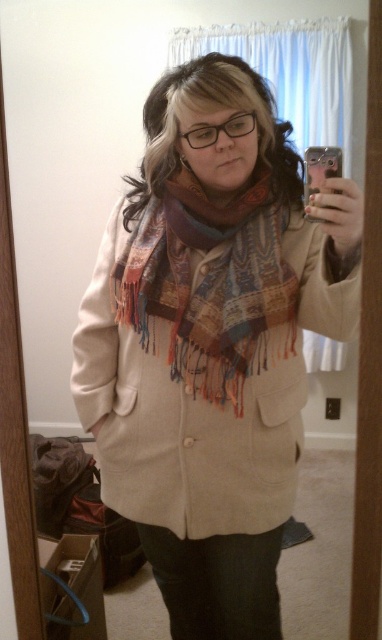
Question: Is paisley scarf at center below metallic silver phone at upper right?

Choices:
 (A) yes
 (B) no

Answer: (A)

Question: Is multicolored woven scarf at center below metallic silver phone at upper right?

Choices:
 (A) no
 (B) yes

Answer: (B)

Question: Which of the following is the closest to the observer?

Choices:
 (A) paisley scarf at center
 (B) metallic silver phone at upper right
 (C) multicolored woven scarf at center

Answer: (A)

Question: Which point is farther from the camera taking this photo?

Choices:
 (A) (252, 230)
 (B) (307, 164)

Answer: (A)

Question: Where is paisley scarf at center located in relation to metallic silver phone at upper right in the image?

Choices:
 (A) left
 (B) right

Answer: (A)

Question: Based on their relative distances, which object is nearer to the paisley scarf at center?

Choices:
 (A) multicolored woven scarf at center
 (B) metallic silver phone at upper right

Answer: (A)